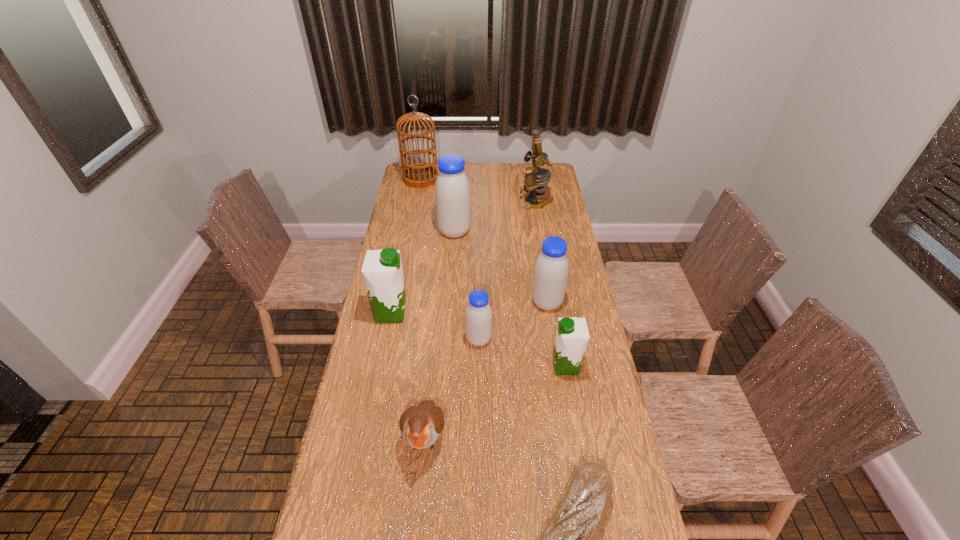
The height and width of the screenshot is (540, 960). In order to click on the nearest blue soya milk in this screenshot , I will do `click(478, 316)`.

The image size is (960, 540). Identify the location of the second nearest soya milk. (478, 316).

Where is `the second shortest object`? The width and height of the screenshot is (960, 540). the second shortest object is located at coordinates (421, 425).

Locate an element on the screen. brown bird is located at coordinates (421, 425).

Identify the location of vacant region located 0.070m on the back of the birdcage. (423, 164).

Find the location of `vacant space situated 0.150m on the back of the eighth nearest object`. vacant space situated 0.150m on the back of the eighth nearest object is located at coordinates 533,178.

At what (x,y) coordinates should I click in order to perform the action: click on vacant space located 0.350m on the back of the farthest blue soya milk. Please return your answer as a coordinate pair (x, y). This screenshot has width=960, height=540. Looking at the image, I should click on (458, 184).

The width and height of the screenshot is (960, 540). In order to click on vacant space positioned 0.180m on the front-facing side of the bigger green soya milk in this screenshot , I will do `click(455, 313)`.

Where is `vacant space situated 0.210m on the left of the rightmost blue soya milk`? vacant space situated 0.210m on the left of the rightmost blue soya milk is located at coordinates (478, 302).

Identify the location of free region located on the front-facing side of the nearer green soya milk. (528, 366).